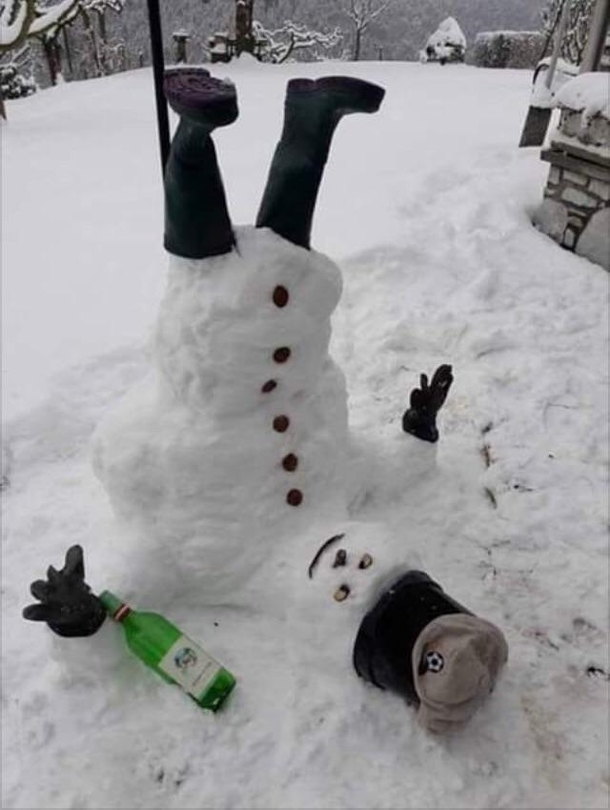
The image size is (610, 810). Find the location of `soccer ball decal`. soccer ball decal is located at coordinates (432, 663).